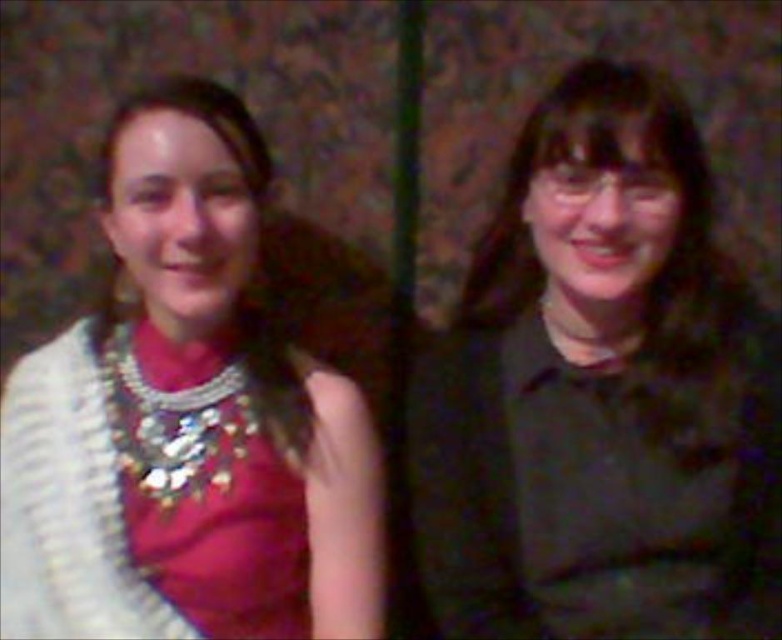
Is shiny silver necklace at left above shiny metallic necklace at left?

Yes.

The width and height of the screenshot is (782, 640). I want to click on shiny silver necklace at left, so click(x=187, y=419).

Who is lower down, dark green shirt at right or shiny silver necklace at left?

shiny silver necklace at left is below.

Locate an element on the screen. dark green shirt at right is located at coordinates (601, 392).

Does dark green shirt at right appear under shiny metallic necklace at left?

Actually, dark green shirt at right is above shiny metallic necklace at left.

Who is more forward, (542, 513) or (20, 522)?

Point (542, 513) is more forward.

The height and width of the screenshot is (640, 782). What are the coordinates of `dark green shirt at right` in the screenshot? It's located at (601, 392).